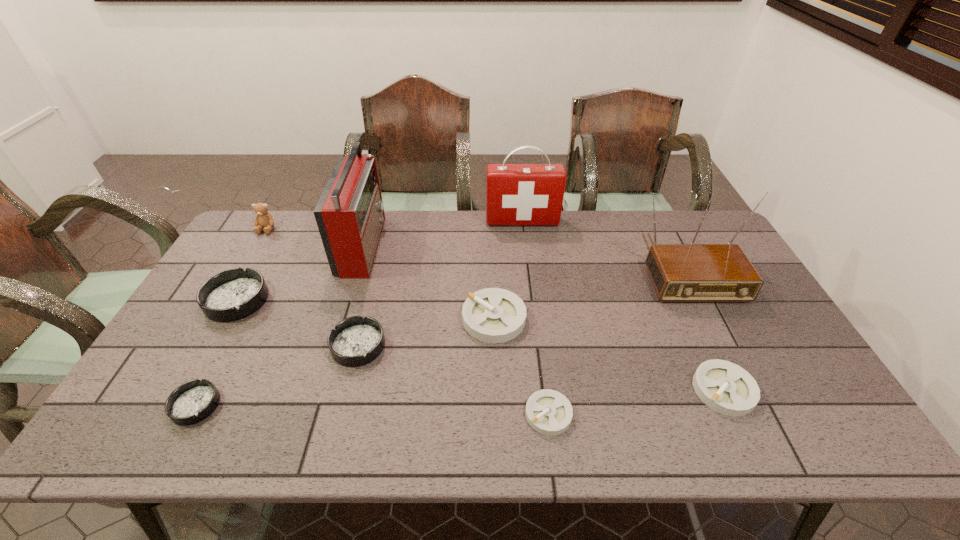
I want to click on free space located 0.280m on the back of the rightmost gray ashtray, so click(x=677, y=289).

Image resolution: width=960 pixels, height=540 pixels. In order to click on vacant position located 0.320m on the back of the smallest dark ashtray in this screenshot , I will do `click(254, 293)`.

I want to click on blank space located on the right of the smallest gray ashtray, so click(x=692, y=414).

Identify the location of the first-aid kit positioned at the far edge. click(x=516, y=194).

You are a GUI agent. You are given a task and a screenshot of the screen. Output one action in this format:
    pyautogui.click(x=<x>, y=<y>)
    Task: Click on the teddy bear situated at the far edge
    
    Given the screenshot: What is the action you would take?
    pyautogui.click(x=263, y=219)

Locate an element on the screen. This screenshot has width=960, height=540. teddy bear present at the left edge is located at coordinates (263, 219).

I want to click on radio_receiver that is positioned at the right edge, so (692, 272).

This screenshot has width=960, height=540. I want to click on ashtray positioned at the right edge, so click(x=725, y=387).

Locate an element on the screen. Image resolution: width=960 pixels, height=540 pixels. object that is at the far left corner is located at coordinates (263, 219).

Identify the location of object that is at the near left corner. (193, 401).